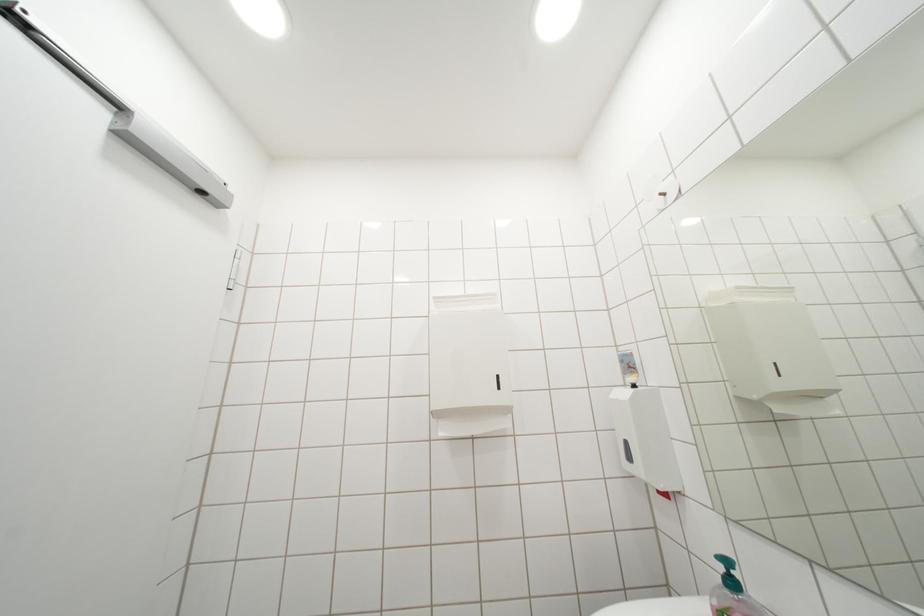
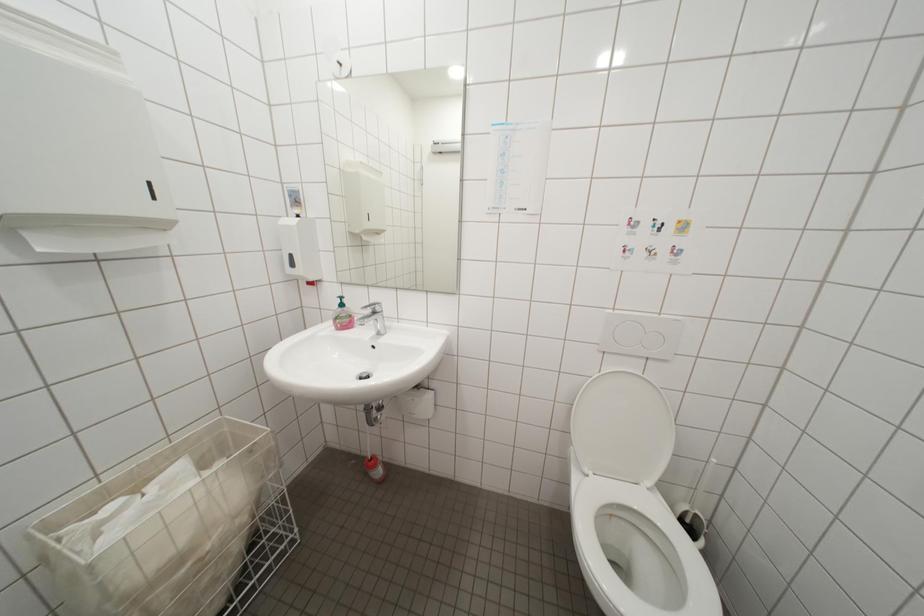
How did the camera likely rotate?

The rotation direction of the camera is right-down.